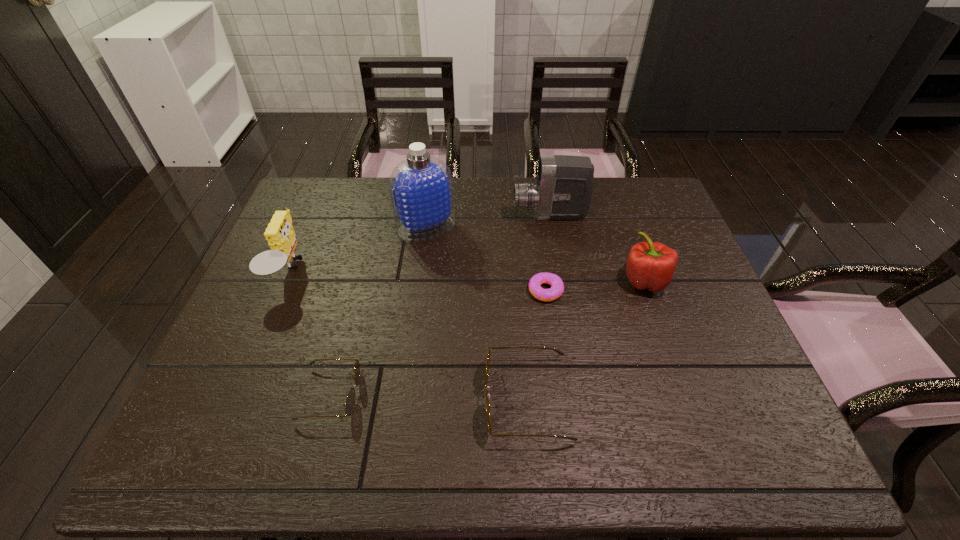
Observe the arrangement of all sunglassess in the image. To keep them evenly spaced, where would you place another sunglasses on the right? Please locate a free space. Please provide its 2D coordinates. Your answer should be formatted as a tuple, i.e. [(x, y)], where the tuple contains the x and y coordinates of a point satisfying the conditions above.

[(727, 404)]